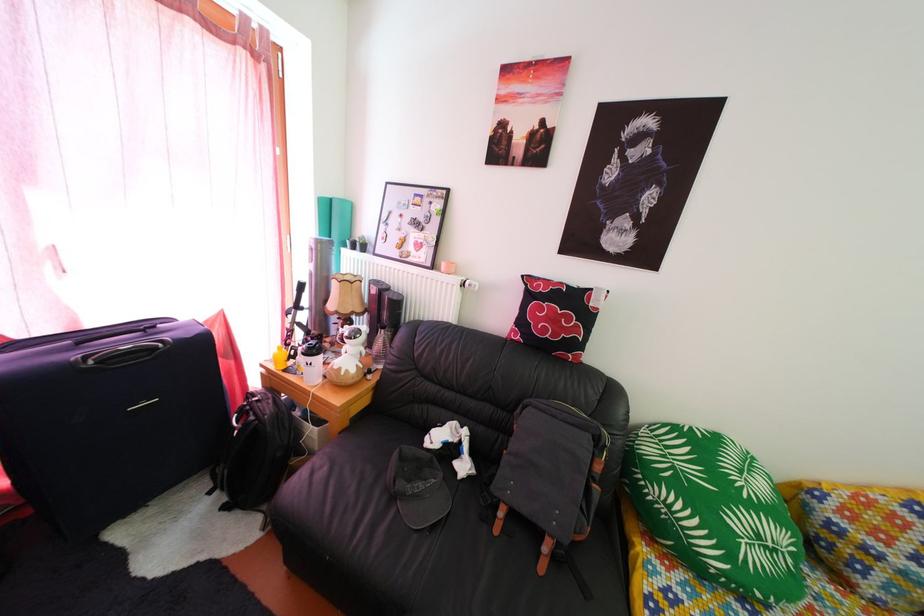
Find where to grasp the white shaker bottle. Please return your answer as a coordinate pair (x, y).

(380, 347)